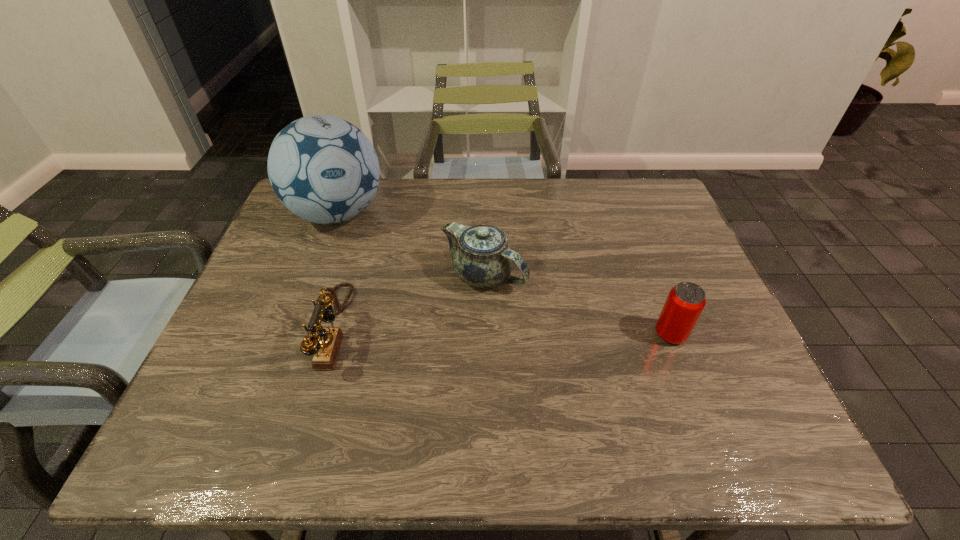
In order to click on free space on the desktop that is between the telephone and the can and is positioned on the side with brand of the tallest object in this screenshot , I will do `click(464, 331)`.

Where is `free spot on the desktop that is between the telephone and the rightmost object and is positioned from the spout of the chinaware`? The width and height of the screenshot is (960, 540). free spot on the desktop that is between the telephone and the rightmost object and is positioned from the spout of the chinaware is located at coordinates (544, 332).